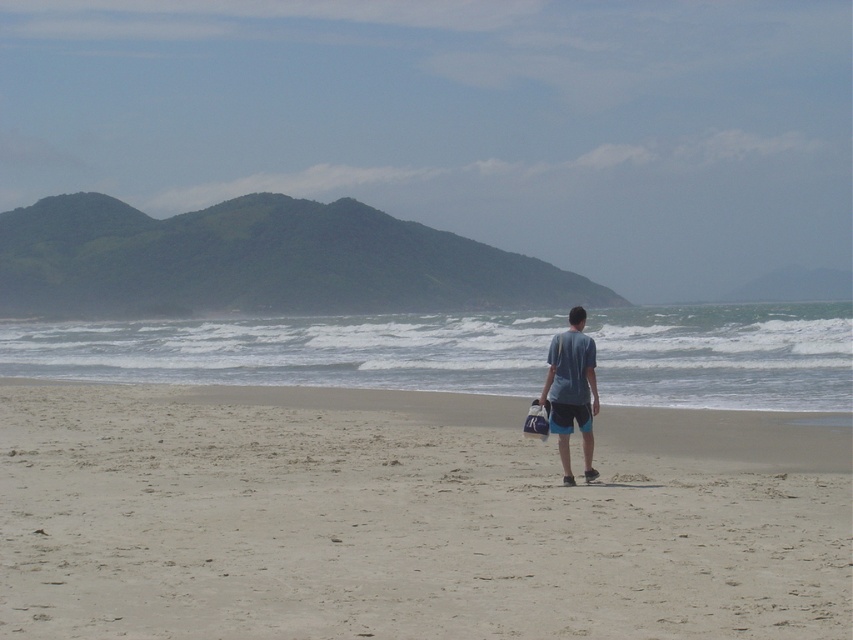
Question: Which point appears closest to the camera in this image?

Choices:
 (A) (437, 580)
 (B) (567, 477)

Answer: (A)

Question: Is light beige sand at center below blue cotton shirt at center?

Choices:
 (A) no
 (B) yes

Answer: (B)

Question: Is light beige sand at center behind blue cotton shirt at center?

Choices:
 (A) no
 (B) yes

Answer: (A)

Question: Is light beige sand at center wider than blue cotton shirt at center?

Choices:
 (A) no
 (B) yes

Answer: (B)

Question: Among these points, which one is nearest to the camera?

Choices:
 (A) (508, 445)
 (B) (585, 420)

Answer: (B)